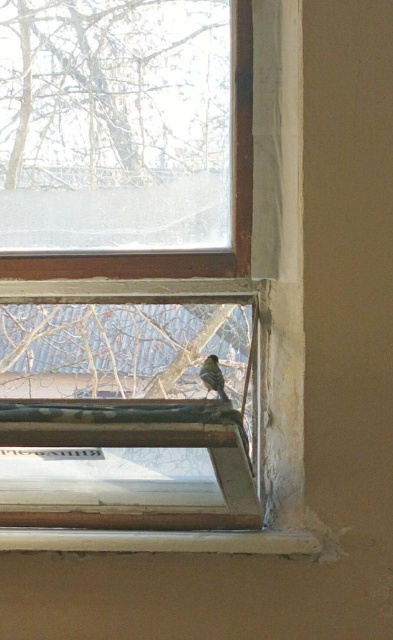
Question: Is clear glass window at center above brown fuzzy bird at lower center?

Choices:
 (A) no
 (B) yes

Answer: (A)

Question: Which point is closer to the camera?

Choices:
 (A) clear glass window at center
 (B) brown fuzzy bird at lower center

Answer: (A)

Question: Which of the following is the closest to the observer?

Choices:
 (A) wooden frame at lower center
 (B) clear glass window at center
 (C) brown fuzzy bird at lower center

Answer: (B)

Question: Is clear glass window at center further to the viewer compared to brown fuzzy bird at lower center?

Choices:
 (A) no
 (B) yes

Answer: (A)

Question: Does clear glass window at center have a greater width compared to brown fuzzy bird at lower center?

Choices:
 (A) no
 (B) yes

Answer: (B)

Question: Which of the following is the closest to the observer?

Choices:
 (A) (205, 380)
 (B) (251, 516)

Answer: (B)